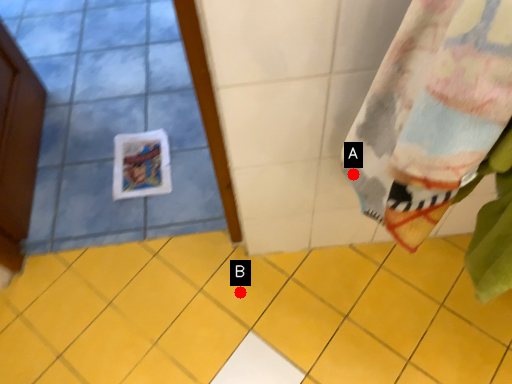
Question: Two points are circled on the image, labeled by A and B beside each circle. Which point appears farthest from the camera in this image?

Choices:
 (A) A is further
 (B) B is further

Answer: (B)